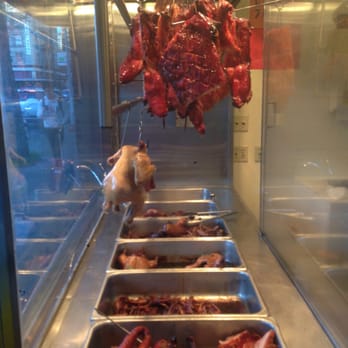
Identify the location of silver metallic buffet trays. (203, 188), (212, 203), (222, 219), (232, 241), (245, 272), (269, 319).